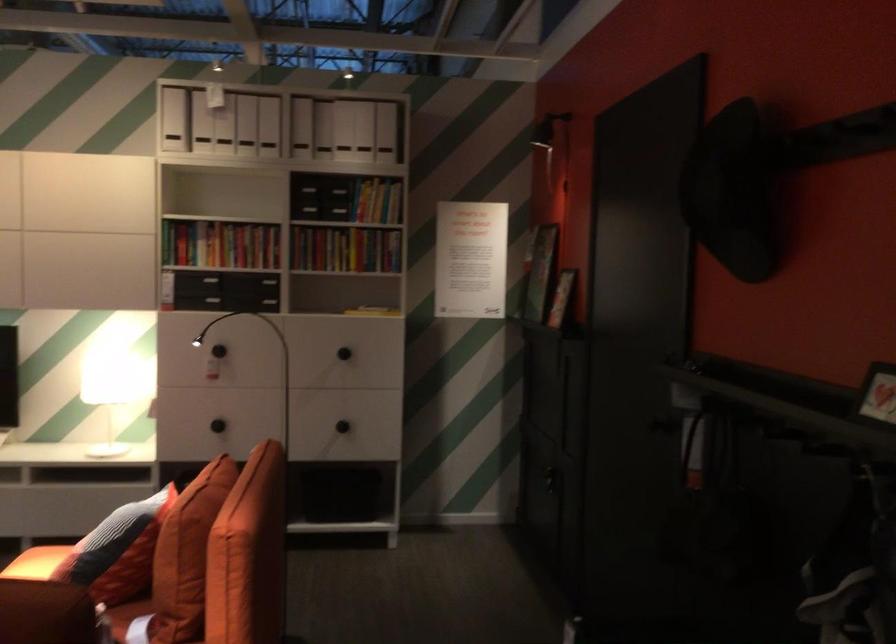
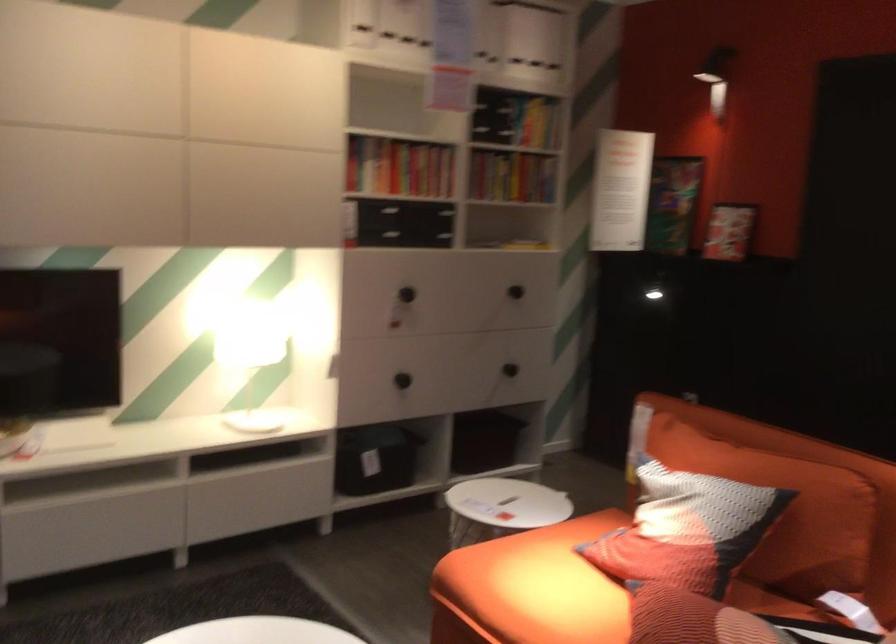
Locate, in the second image, the point that corresponds to (108,391) in the first image.

(319, 348)